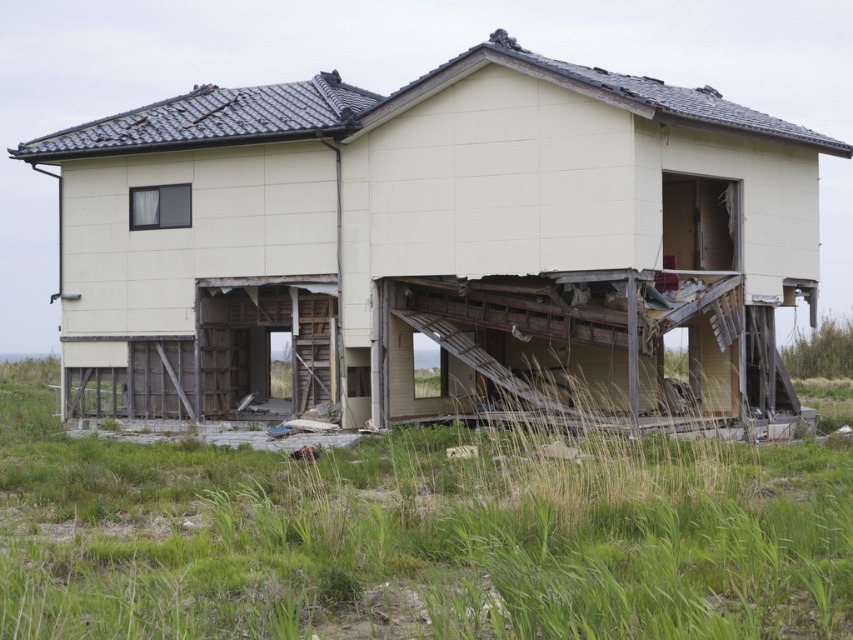
You are a construction worker assessing the damage to the beige wood house at center. You need to place a 10 meter long safety barrier around the perimeter of the house. Considering the green grass at lower center, will the barrier be sufficient to enclose the entire house?

The beige wood house at center is wider than the green grass at lower center. Since the house is wider, the 10 meter barrier may not be sufficient to fully enclose it, as the grass area is narrower and the house extends beyond it.

You are standing in front of the damaged house and want to place a new support beam between the two points, point (633,253) and point (132,480). Which point should the beam start from to ensure it goes from the front to the back of the house?

The beam should start from point (132,480) because it is in front, and point (633,253) is behind it, so placing the beam from the front point ensures it extends toward the back.

You are standing in a park and see the beige wood house at center and the green grass at lower center. Which object is located to the left of the other?

The beige wood house at center is positioned on the left side of green grass at lower center.